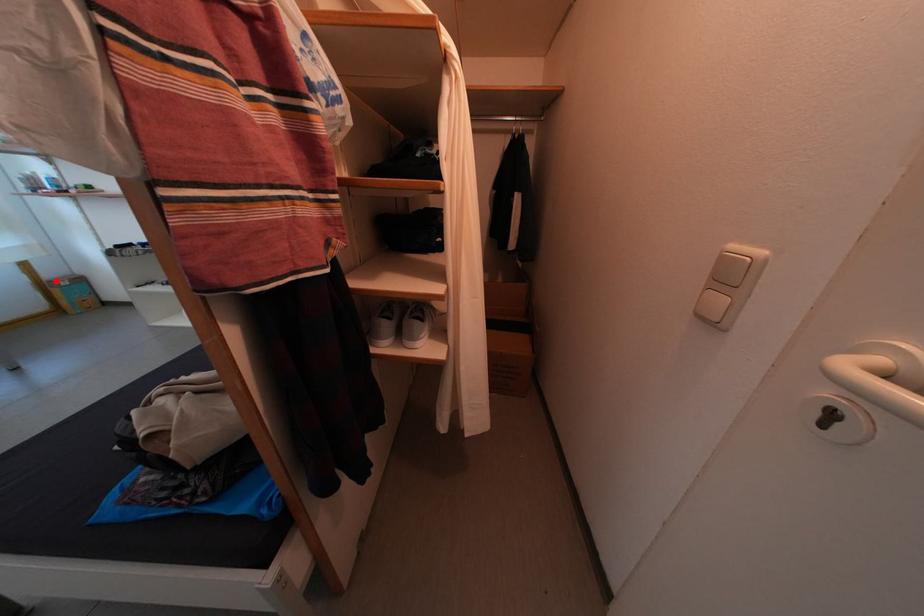
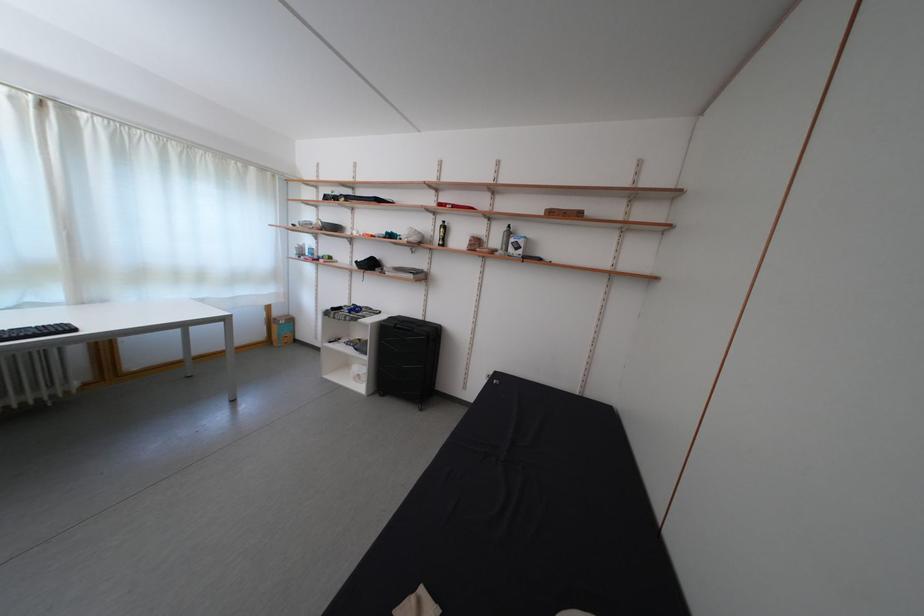
In the second image, find the point that corresponds to the highlighted location in the first image.

(285, 320)